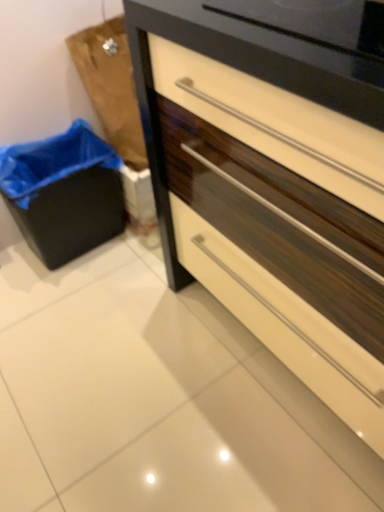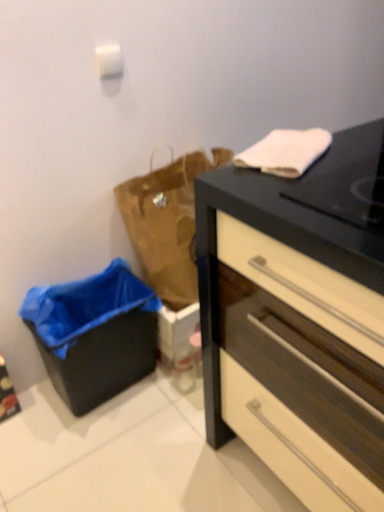
Question: How did the camera likely rotate when shooting the video?

Choices:
 (A) rotated downward
 (B) rotated upward

Answer: (B)